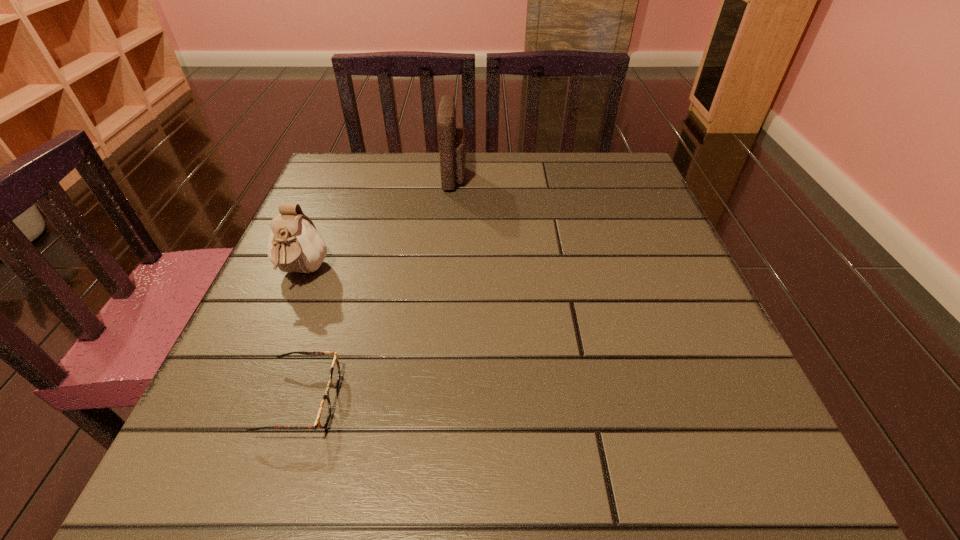
This screenshot has width=960, height=540. I want to click on object at the near edge, so click(x=324, y=412).

Locate an element on the screen. Image resolution: width=960 pixels, height=540 pixels. pouch present at the left edge is located at coordinates (294, 245).

Find the location of a particular element. spectacles present at the left edge is located at coordinates (324, 412).

The height and width of the screenshot is (540, 960). Find the location of `object positioned at the near left corner`. object positioned at the near left corner is located at coordinates (324, 412).

Find the location of a particular element. vacant space at the far edge of the desktop is located at coordinates (523, 175).

The width and height of the screenshot is (960, 540). I want to click on free region at the near edge of the desktop, so click(395, 480).

Locate an element on the screen. vacant space at the left edge of the desktop is located at coordinates (293, 357).

Identify the location of vacant region at the right edge of the desktop. (587, 217).

Find the location of `vacant space at the far left corner`. vacant space at the far left corner is located at coordinates (344, 197).

Find the location of a particular element. The width and height of the screenshot is (960, 540). blank space at the near right corner of the desktop is located at coordinates (751, 453).